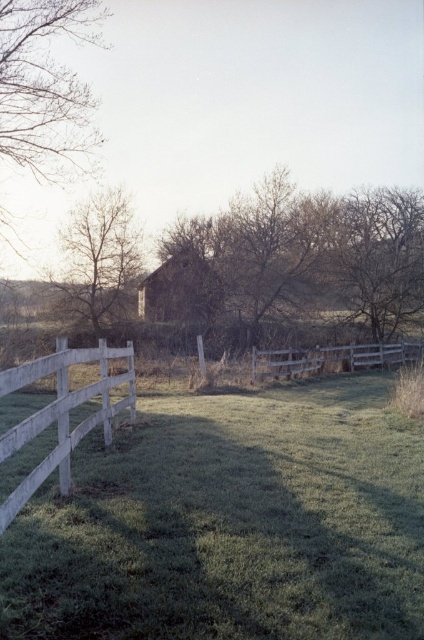
Which is behind, point (395, 196) or point (418, 353)?

Point (395, 196)

Which of these two, brown wood tree at center or wooden fence at center, stands shorter?

Standing shorter between the two is wooden fence at center.

The image size is (424, 640). Describe the element at coordinates (306, 259) in the screenshot. I see `brown wood tree at center` at that location.

Image resolution: width=424 pixels, height=640 pixels. In order to click on brown wood tree at center in this screenshot , I will do `click(306, 259)`.

Does white wooden fence at left have a greater width compared to wooden fence at center?

In fact, white wooden fence at left might be narrower than wooden fence at center.

Measure the distance between white wooden fence at left and camera.

4.02 meters

Who is more forward, (133, 406) or (382, 352)?

Point (133, 406) is in front.

Locate an element on the screen. The width and height of the screenshot is (424, 640). white wooden fence at left is located at coordinates (61, 413).

Is brown wood tree at center smaller than white wooden fence at left?

Actually, brown wood tree at center might be larger than white wooden fence at left.

Looking at this image, is brown wood tree at center to the left of white wooden fence at left from the viewer's perspective?

In fact, brown wood tree at center is to the right of white wooden fence at left.

Is point (217, 298) positioned in front of point (66, 481)?

No, (217, 298) is further to viewer.

This screenshot has height=640, width=424. What are the coordinates of `brown wood tree at center` in the screenshot? It's located at (306, 259).